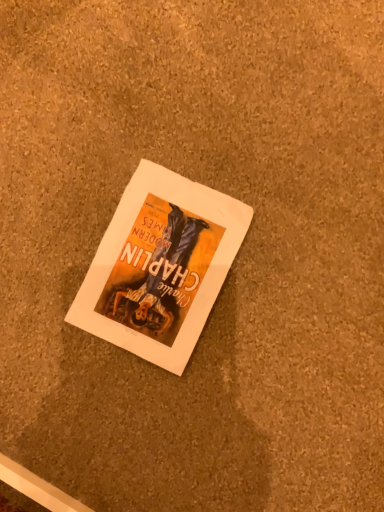
I want to click on vacant area that is situated to the right of matte paper book at center, so click(x=295, y=226).